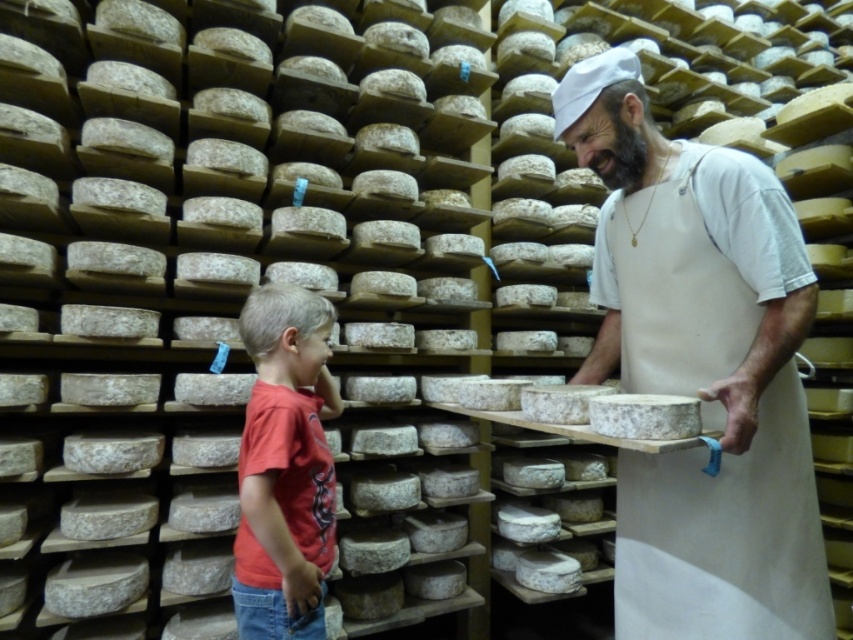
Question: Among these points, which one is farthest from the camera?

Choices:
 (A) (795, 545)
 (B) (305, 352)

Answer: (B)

Question: Which of the following is the farthest from the observer?

Choices:
 (A) (809, 556)
 (B) (306, 356)

Answer: (B)

Question: Does smooth white cheese at center have a greater width compared to red cotton shirt at lower left?

Choices:
 (A) yes
 (B) no

Answer: (A)

Question: Is smooth white cheese at center positioned behind red cotton shirt at lower left?

Choices:
 (A) yes
 (B) no

Answer: (B)

Question: Is smooth white cheese at center wider than red cotton shirt at lower left?

Choices:
 (A) no
 (B) yes

Answer: (B)